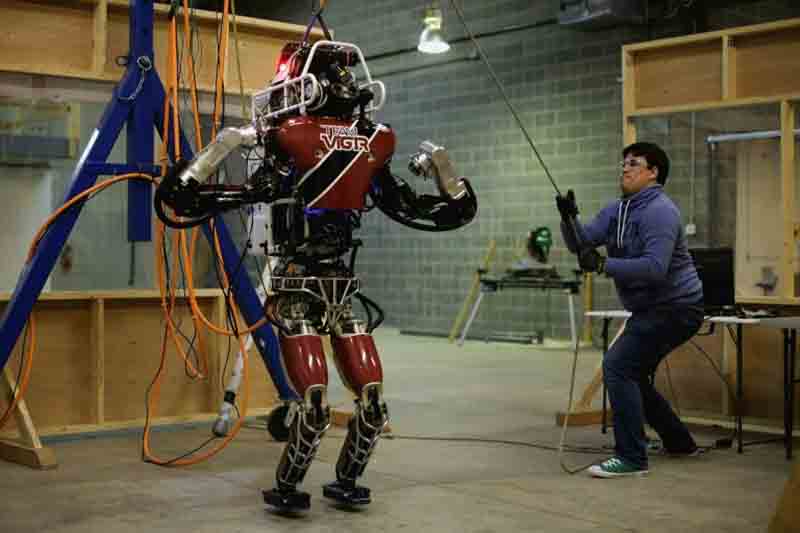
The image size is (800, 533). I want to click on light bulb, so click(430, 49).